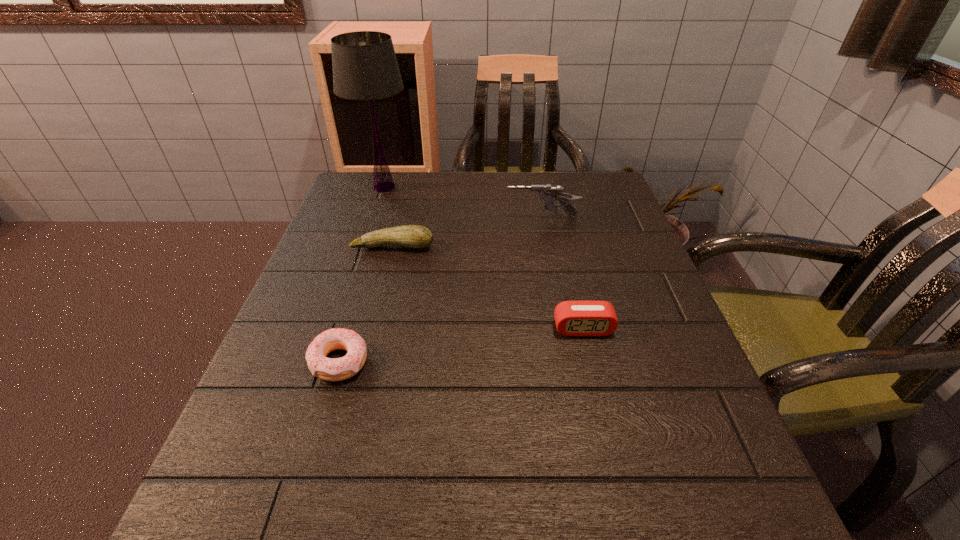
At what (x,y) coordinates should I click in order to perform the action: click on gun that is at the right edge. Please return your answer as a coordinate pair (x, y). Looking at the image, I should click on (548, 193).

This screenshot has width=960, height=540. Find the location of `alarm clock at the right edge`. alarm clock at the right edge is located at coordinates (573, 318).

Find the location of a particular element. The height and width of the screenshot is (540, 960). object that is at the far left corner is located at coordinates (365, 68).

The image size is (960, 540). Identify the location of object that is at the far right corner. (548, 193).

You are a GUI agent. You are given a task and a screenshot of the screen. Output one action in this format:
    pyautogui.click(x=<x>, y=<y>)
    Task: Click on the free space at the far edge
    
    Given the screenshot: What is the action you would take?
    pyautogui.click(x=488, y=187)

What are the coordinates of `free region at the near edge of the desktop` in the screenshot? It's located at (337, 516).

The image size is (960, 540). I want to click on free space at the left edge of the desktop, so click(x=355, y=290).

Find the location of a particular element. Image resolution: width=960 pixels, height=540 pixels. free spot at the right edge of the desktop is located at coordinates (729, 443).

At what (x,y) coordinates should I click in order to perform the action: click on vacant area at the far left corner of the desktop. Please return your answer as a coordinate pair (x, y). Looking at the image, I should click on (337, 216).

At what (x,y) coordinates should I click in order to perform the action: click on free spot between the zucchini and the fourth shortest object. Please return your answer as a coordinate pair (x, y). This screenshot has height=540, width=960. Looking at the image, I should click on (468, 232).